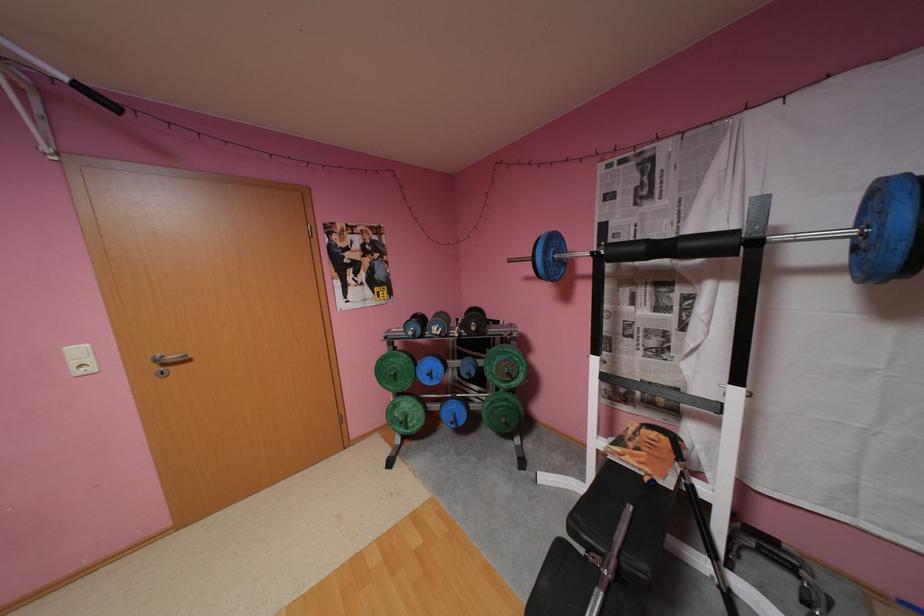
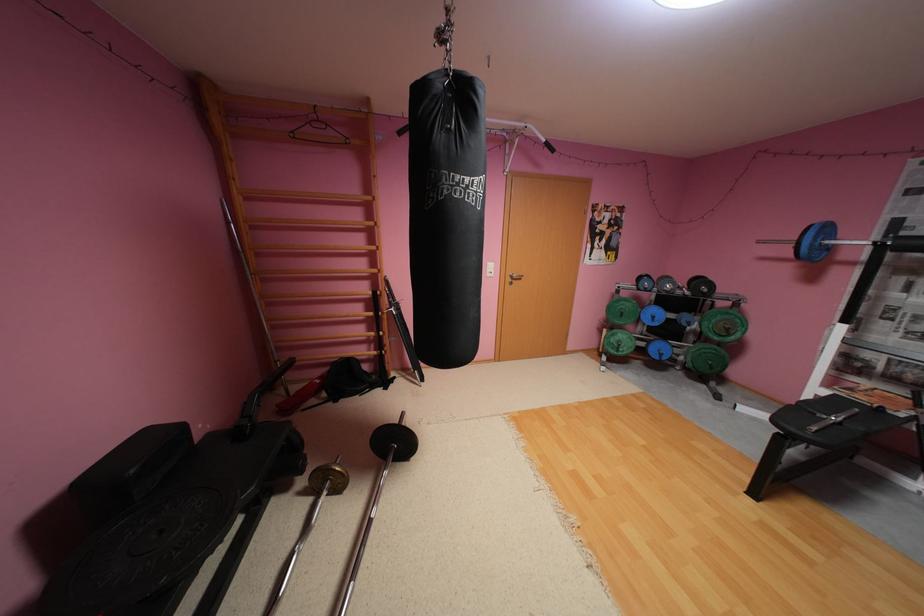
Find the pixel in the second image that matches (416,427) in the first image.

(626, 351)